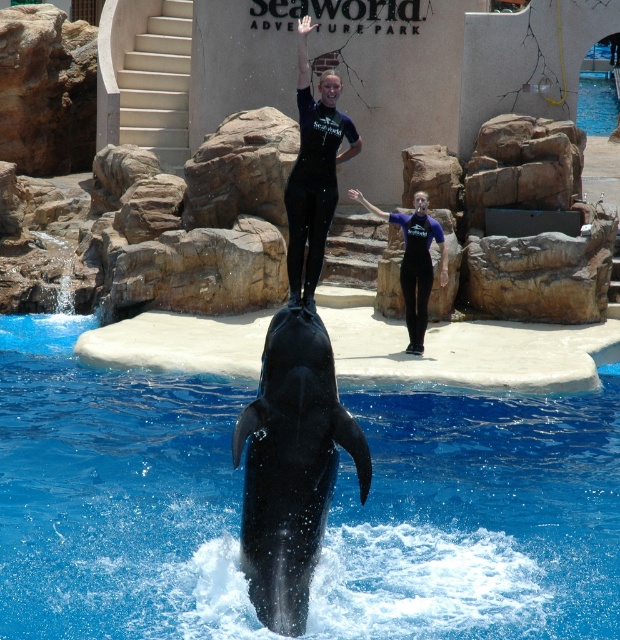
You are a visitor at SeaWorld Adventure Park and want to take a photo of the blue smooth water at center and the blue matte wetsuit at center. You have a camera with a 5 meter range. Can you capture both objects in one photo without moving?

The distance between the blue smooth water at center and the blue matte wetsuit at center is 6.83 meters. Since your camera has a 5 meter range, it is not possible to capture both objects in one photo without moving.

You are a visitor at SeaWorld Adventure Park and want to take a photo of both the black matte wetsuit at center and the blue matte wetsuit at center in the dolphin show. The camera you have can focus on objects up to 6 meters away. Can you capture both individuals in one photo without moving your position?

The black matte wetsuit at center is 6.41 meters away from the blue matte wetsuit at center. Since the maximum focusing distance of your camera is 6 meters, you cannot capture both individuals in one photo without moving your position because the distance between them exceeds the camera range.

You are a photographer at SeaWorld Adventure Park and need to capture a wide shot of the dolphin show. You want to ensure both the blue smooth water at center and the blue matte wetsuit at center are clearly visible. Which object should you focus on to ensure the wider area is captured?

The blue smooth water at center has a greater width than the blue matte wetsuit at center, so focusing on the blue smooth water at center will ensure the wider area is captured.